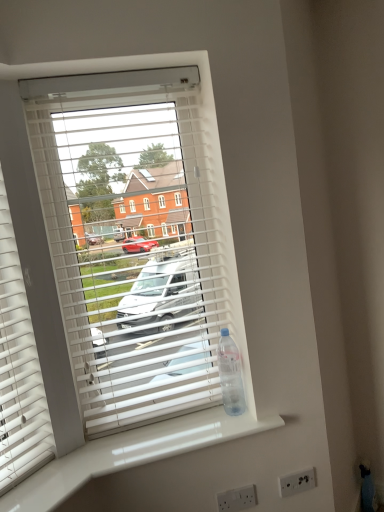
Question: From the image's perspective, is white plastic blinds at center above or below white glossy counter top at lower center?

Choices:
 (A) below
 (B) above

Answer: (B)

Question: From a real-world perspective, is white plastic blinds at center positioned above or below white glossy counter top at lower center?

Choices:
 (A) below
 (B) above

Answer: (B)

Question: Which object is positioned farthest from the clear plastic bottle at right?

Choices:
 (A) white plastic electric outlet at lower center, the 1th electric outlet when ordered from front to back
 (B) white plastic electric outlet at lower right, arranged as the 2th electric outlet when viewed from the left
 (C) white glossy counter top at lower center
 (D) white plastic blinds at center

Answer: (D)

Question: Which object is positioned closest to the white plastic electric outlet at lower right, positioned as the 2th electric outlet in front-to-back order?

Choices:
 (A) white glossy counter top at lower center
 (B) clear plastic bottle at right
 (C) white plastic blinds at center
 (D) white plastic electric outlet at lower center, the first electric outlet when ordered from left to right

Answer: (D)